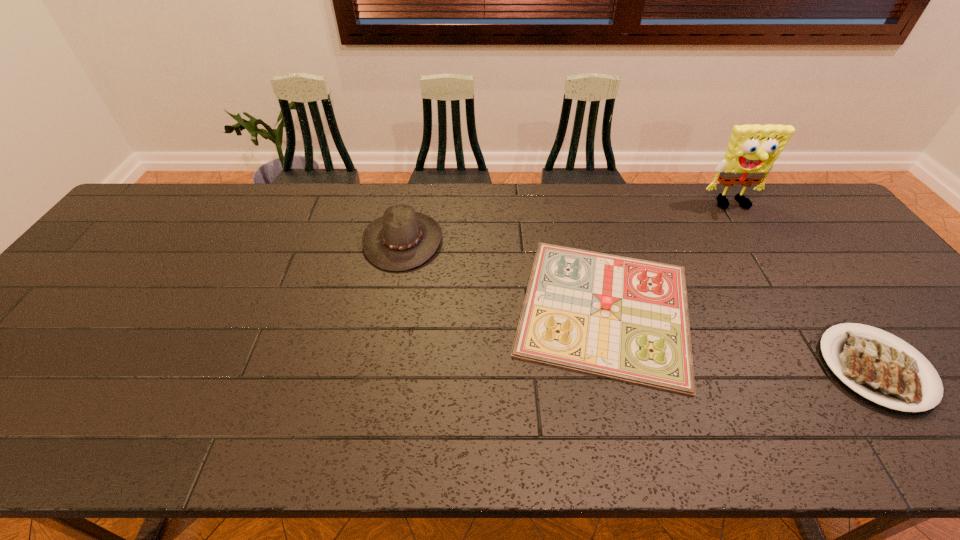
Locate which object is the second closest to the second tallest object. Please provide its 2D coordinates. Your answer should be formatted as a tuple, i.e. [(x, y)], where the tuple contains the x and y coordinates of a point satisfying the conditions above.

[(752, 150)]

This screenshot has width=960, height=540. In order to click on object that is the second closest to the shortest object in this screenshot , I will do `click(752, 150)`.

Locate an element on the screen. The width and height of the screenshot is (960, 540). vacant space that satisfies the following two spatial constraints: 1. on the front-facing side of the third object from right to left; 2. on the left side of the third shortest object is located at coordinates (391, 309).

This screenshot has height=540, width=960. Find the location of `vacant space that satisfies the following two spatial constraints: 1. on the front-facing side of the leftmost object; 2. on the back side of the third object from right to left`. vacant space that satisfies the following two spatial constraints: 1. on the front-facing side of the leftmost object; 2. on the back side of the third object from right to left is located at coordinates (391, 309).

Locate an element on the screen. free space that satisfies the following two spatial constraints: 1. on the front-facing side of the third tallest object; 2. on the right side of the third shortest object is located at coordinates (391, 309).

Where is `free spot that satisfies the following two spatial constraints: 1. on the front-facing side of the leftmost object; 2. on the back side of the second shortest object`? This screenshot has height=540, width=960. free spot that satisfies the following two spatial constraints: 1. on the front-facing side of the leftmost object; 2. on the back side of the second shortest object is located at coordinates (391, 309).